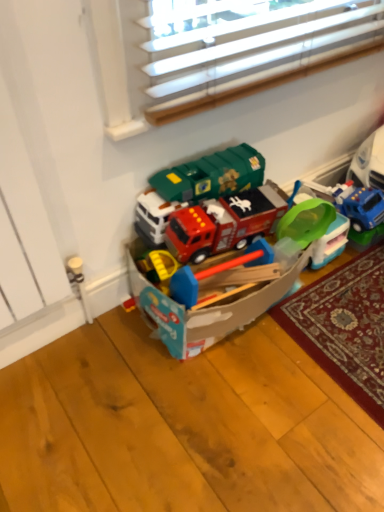
Image resolution: width=384 pixels, height=512 pixels. I want to click on vacant point to the right of matte plastic toy box at center, the second toy positioned from the right, so click(339, 316).